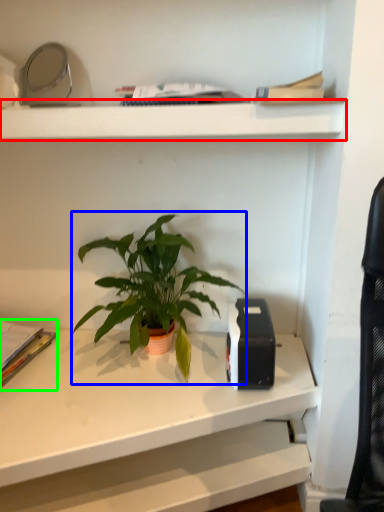
Question: Based on their relative distances, which object is farther from shelf (highlighted by a red box)? Choose from houseplant (highlighted by a blue box) and paperback book (highlighted by a green box).

Choices:
 (A) houseplant
 (B) paperback book

Answer: (B)